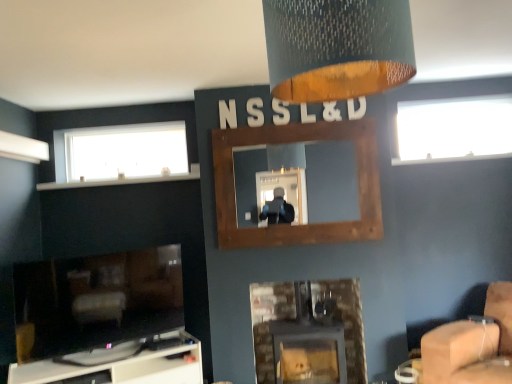
Question: Should I look upward or downward to see white plastic mantle at upper left?

Choices:
 (A) up
 (B) down

Answer: (A)

Question: Is transparent glass window at upper right, the first window from the right, positioned with its back to rustic wood fireplace at center, marked as the 2th fireplace in a left-to-right arrangement?

Choices:
 (A) yes
 (B) no

Answer: (B)

Question: Is transparent glass window at upper right, the 2th window viewed from the left, in front of rustic wood fireplace at center, marked as the 2th fireplace in a left-to-right arrangement?

Choices:
 (A) no
 (B) yes

Answer: (A)

Question: From the image's perspective, is transparent glass window at upper right, the 2th window viewed from the left, over rustic wood fireplace at center, the 2th fireplace positioned from the right?

Choices:
 (A) no
 (B) yes

Answer: (B)

Question: Is transparent glass window at upper right, the first window from the right, positioned beyond the bounds of rustic wood fireplace at center, marked as the 2th fireplace in a left-to-right arrangement?

Choices:
 (A) yes
 (B) no

Answer: (A)

Question: Can you confirm if transparent glass window at upper right, the first window from the right, is bigger than rustic wood fireplace at center, marked as the 2th fireplace in a left-to-right arrangement?

Choices:
 (A) no
 (B) yes

Answer: (B)

Question: From a real-world perspective, is transparent glass window at upper right, the 2th window viewed from the left, on rustic wood fireplace at center, marked as the 2th fireplace in a left-to-right arrangement?

Choices:
 (A) no
 (B) yes

Answer: (B)

Question: From a real-world perspective, does white glossy tv stand at lower left stand above transparent glass window at upper right, the 2th window viewed from the left?

Choices:
 (A) yes
 (B) no

Answer: (B)

Question: Is white glossy tv stand at lower left at the right side of transparent glass window at upper right, the first window from the right?

Choices:
 (A) no
 (B) yes

Answer: (A)

Question: Can you confirm if white glossy tv stand at lower left is taller than transparent glass window at upper right, the 2th window viewed from the left?

Choices:
 (A) no
 (B) yes

Answer: (B)

Question: Is the position of white glossy tv stand at lower left less distant than that of transparent glass window at upper right, the first window from the right?

Choices:
 (A) no
 (B) yes

Answer: (B)

Question: Is white glossy tv stand at lower left shorter than transparent glass window at upper right, the 2th window viewed from the left?

Choices:
 (A) yes
 (B) no

Answer: (B)

Question: Is transparent glass window at upper right, the first window from the right, surrounded by white glossy tv stand at lower left?

Choices:
 (A) no
 (B) yes

Answer: (A)

Question: Does transparent glass window at upper right, the 2th window viewed from the left, contain textured fabric lampshade at upper center?

Choices:
 (A) no
 (B) yes

Answer: (A)